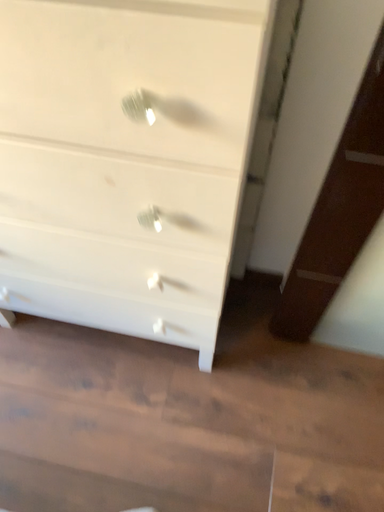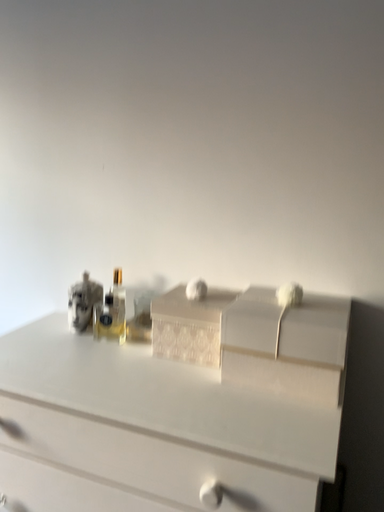
Question: Which way did the camera rotate in the video?

Choices:
 (A) rotated upward
 (B) rotated downward

Answer: (A)